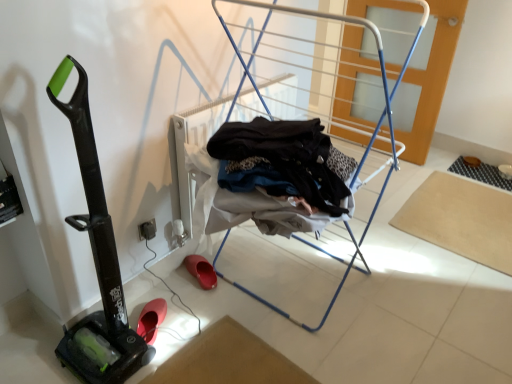
This screenshot has width=512, height=384. Find the location of `free space to the right of metallic blue drying rack at center`. free space to the right of metallic blue drying rack at center is located at coordinates (424, 286).